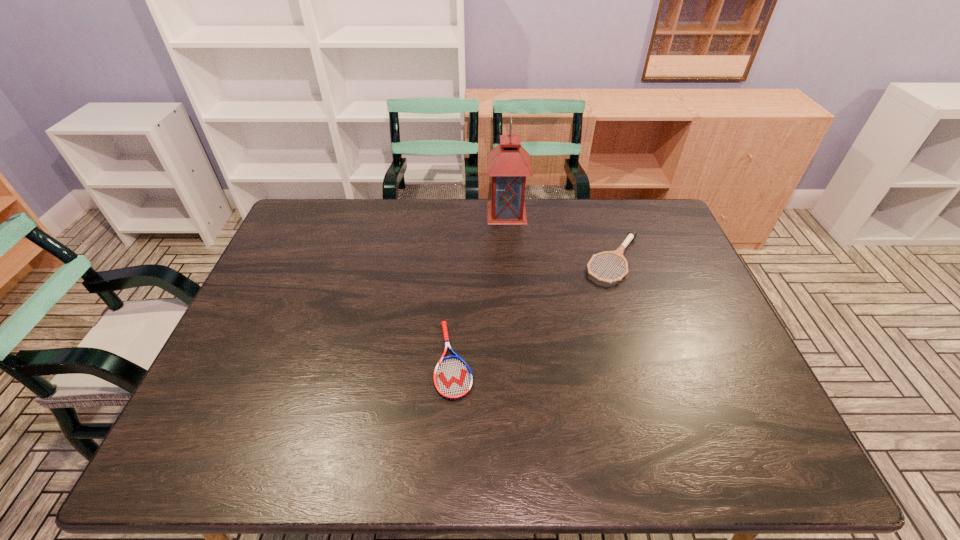
Where is `vacant region between the second farthest object and the left tennis racket`? This screenshot has height=540, width=960. vacant region between the second farthest object and the left tennis racket is located at coordinates (534, 310).

Where is `vacant region between the second object from left to right and the left tennis racket`? This screenshot has width=960, height=540. vacant region between the second object from left to right and the left tennis racket is located at coordinates (480, 286).

Where is `free area in between the nearest object and the lantern`? The width and height of the screenshot is (960, 540). free area in between the nearest object and the lantern is located at coordinates (480, 286).

This screenshot has width=960, height=540. I want to click on empty space between the second object from left to right and the left tennis racket, so click(x=480, y=286).

I want to click on free space between the farthest object and the nearer tennis racket, so click(480, 286).

Identify the location of vacant space that is in between the left tennis racket and the farther tennis racket. The image size is (960, 540). (534, 310).

Where is `vacant area between the left tennis racket and the taller tennis racket`? The height and width of the screenshot is (540, 960). vacant area between the left tennis racket and the taller tennis racket is located at coordinates (534, 310).

Image resolution: width=960 pixels, height=540 pixels. I want to click on vacant area between the second object from left to right and the second farthest object, so click(x=561, y=236).

Find the location of a particular element. unoccupied area between the shortest object and the rightmost object is located at coordinates (534, 310).

Select which object appears as the second closest to the farther tennis racket. Please provide its 2D coordinates. Your answer should be formatted as a tuple, i.e. [(x, y)], where the tuple contains the x and y coordinates of a point satisfying the conditions above.

[(453, 380)]